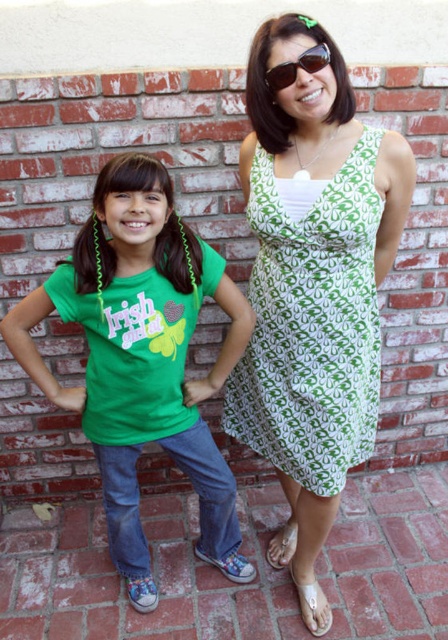
You are trying to decide which clothing item to take from the image. Both the green matte shirt at center and the green printed dress at center are available. If you want the bigger one, which should you choose?

The green matte shirt at center is larger in size than the green printed dress at center, so you should choose the green matte shirt at center.

You are a photographer setting up a shoot with two subjects in front of a brick wall. You notice the green matte shirt at center and the sunglasses at center. Which object is positioned lower on the body?

The green matte shirt at center is below sunglasses at center, so the green matte shirt at center is positioned lower on the body.

You are a photographer trying to capture a clear shot of the green matte shirt at center and the sunglasses at center. Which object should you focus on first to ensure it appears sharp in the photo?

The sunglasses at center is behind the green matte shirt at center, so you should focus on the green matte shirt at center first to ensure it appears sharp. If you focus on the sunglasses at center, the shirt might become slightly blurry due to the depth of field.